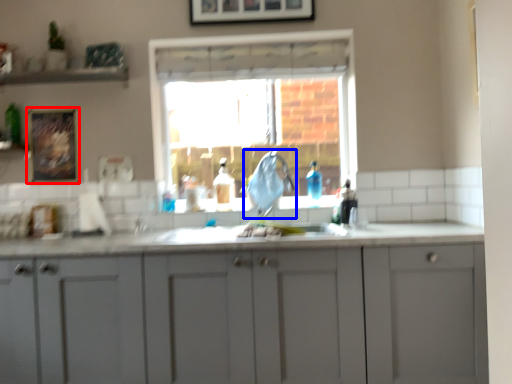
Question: Which of the following is the farthest to the observer, picture frame (highlighted by a red box) or faucet (highlighted by a blue box)?

Choices:
 (A) picture frame
 (B) faucet

Answer: (A)